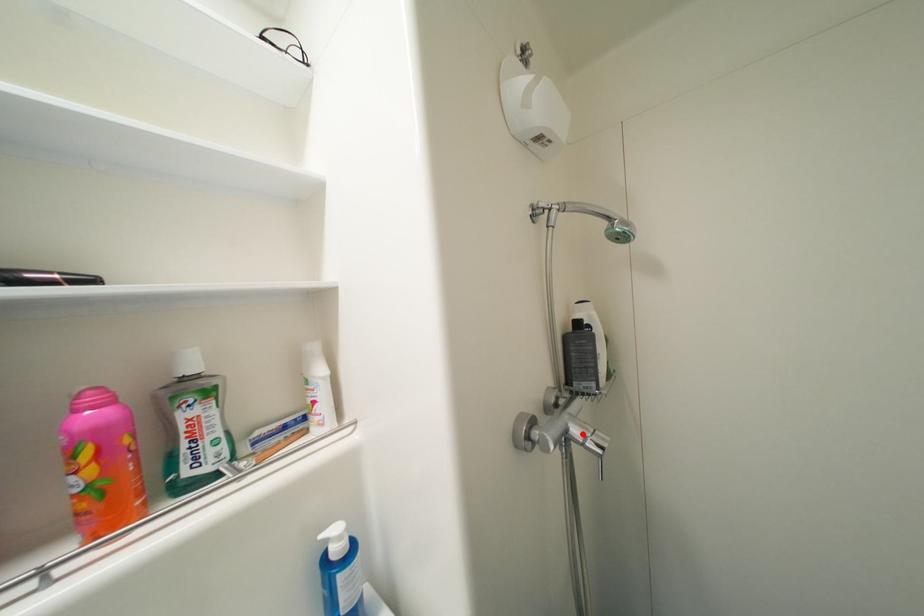
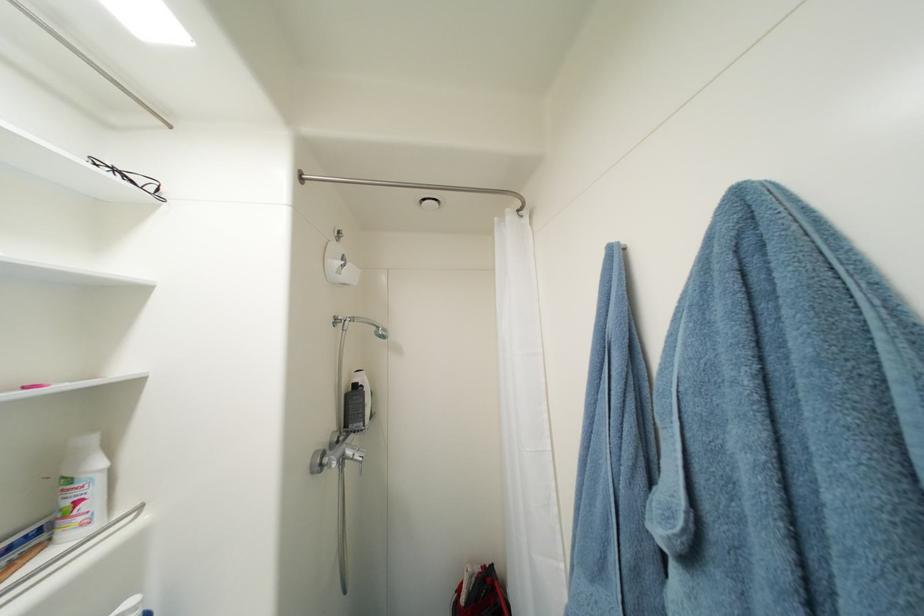
In the second image, find the point that corresponds to the highlighted location in the first image.

(356, 454)